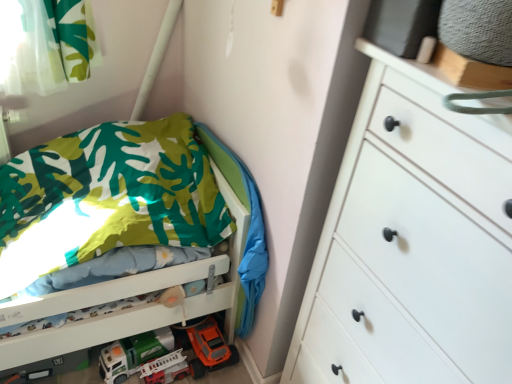
At what (x,y) coordinates should I click in order to perform the action: click on empty space that is ontop of orange plastic toy car at lower center. Please return your answer as a coordinate pair (x, y). Looking at the image, I should click on (209, 331).